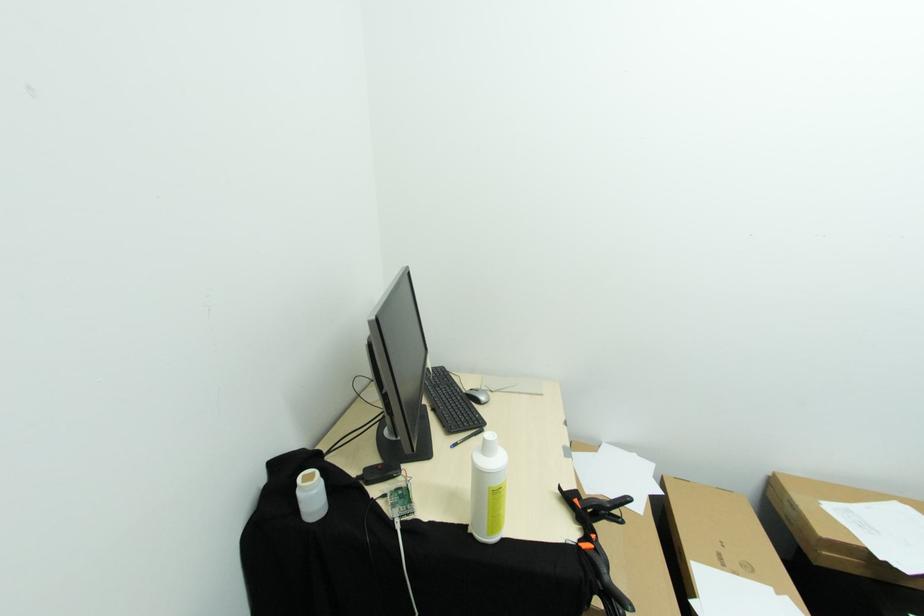
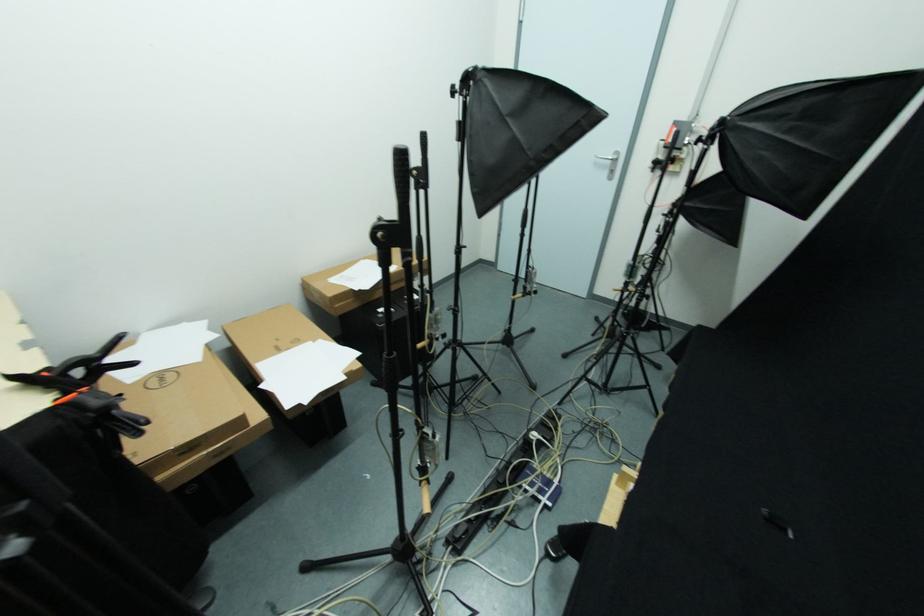
How did the camera likely rotate?

The camera rotated toward right-down.